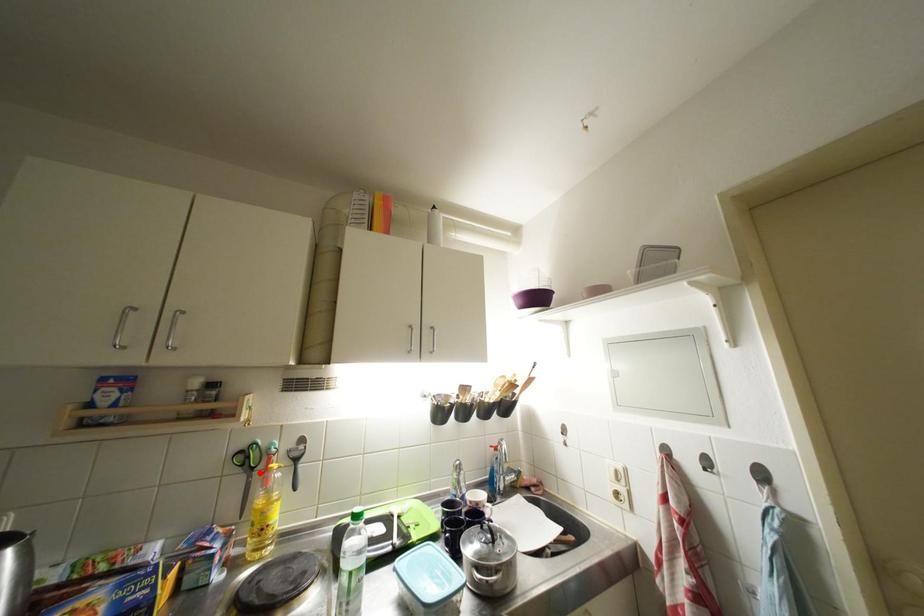
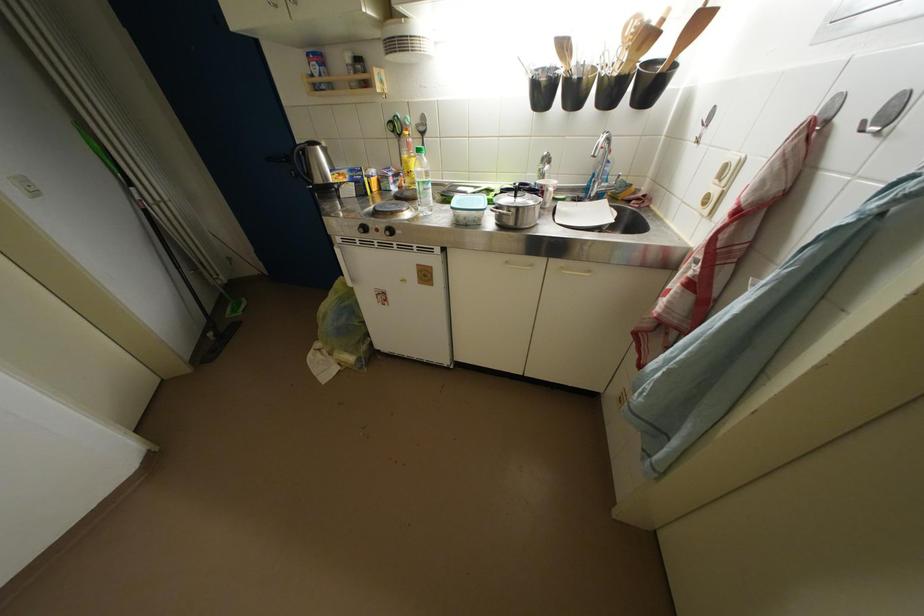
Question: I am providing you with two images of the same scene from different viewpoints. A red point is marked on the first image. Is the red point's position out of view in image 2?

Choices:
 (A) Yes
 (B) No

Answer: (B)